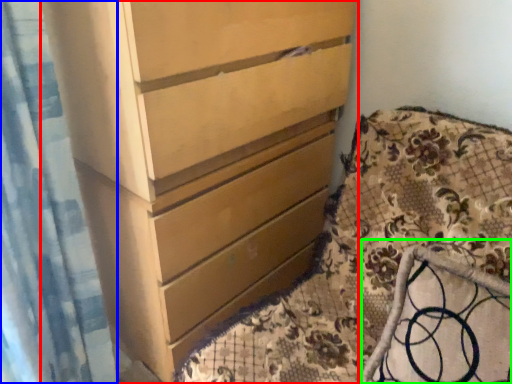
Question: Which is nearer to the chest of drawers (highlighted by a red box)? shower curtain (highlighted by a blue box) or rocking chair (highlighted by a green box).

Choices:
 (A) shower curtain
 (B) rocking chair

Answer: (A)